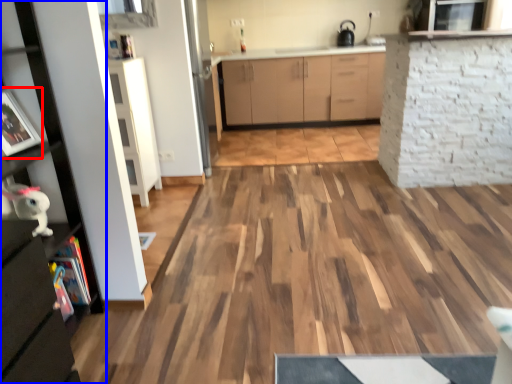
Question: Which of the following is the closest to the observer, picture frame (highlighted by a red box) or cabinetry (highlighted by a blue box)?

Choices:
 (A) picture frame
 (B) cabinetry

Answer: (B)